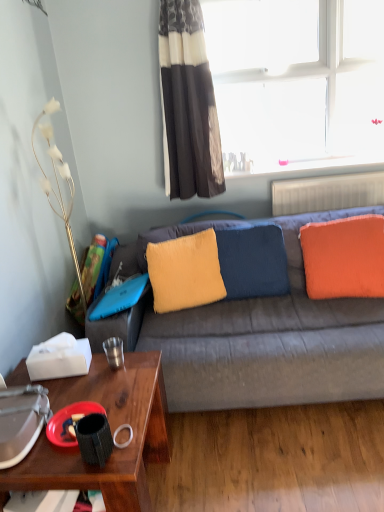
You are a GUI agent. You are given a task and a screenshot of the screen. Output one action in this format:
    pyautogui.click(x=<x>, y=<y>)
    Task: Click on the vacant area that is situated to the right of metallic silver cup at lower left, which is the 2th coffee cup in bottom-to-top order
    The height and width of the screenshot is (512, 384).
    Given the screenshot: What is the action you would take?
    pyautogui.click(x=140, y=360)